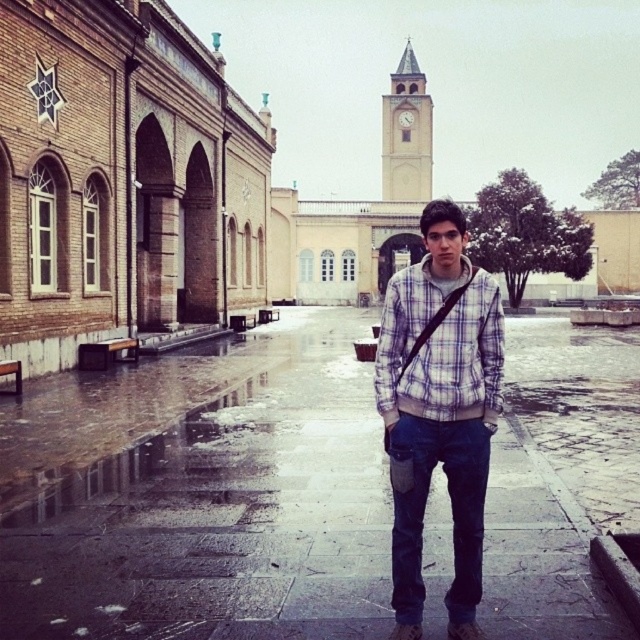
You are standing at the point labeled point (396, 538) and want to walk to the point labeled point (440, 413). Which direction should you face to move towards your destination?

You should face away from the viewer because point (396, 538) is closer to the viewer than point (440, 413).

Consider the image. You are a fashion designer observing the scene. You notice two plaid shirts worn by the person in the center. Which one is taller, the plaid cotton shirt at center or the plaid fabric shirt at center?

The plaid cotton shirt at center is taller than plaid fabric shirt at center.

You are a tourist standing in the courtyard and want to take a photo of the light beige stone clock tower at upper center. To avoid getting your plaid cotton shirt at center wet from the wet ground, where should you position yourself?

The plaid cotton shirt at center is located below the light beige stone clock tower at upper center. To avoid the wet ground, you should position yourself behind the plaid cotton shirt at center, closer to the clock tower, since the ground near the tower might be drier compared to the wet stone pavement in the foreground.